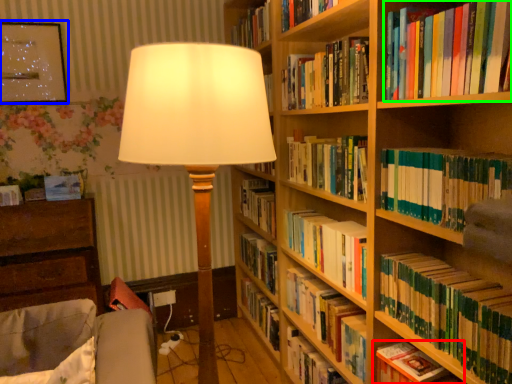
Question: Which is nearer to the book (highlighted by a red box)? picture frame (highlighted by a blue box) or book (highlighted by a green box).

Choices:
 (A) picture frame
 (B) book

Answer: (B)